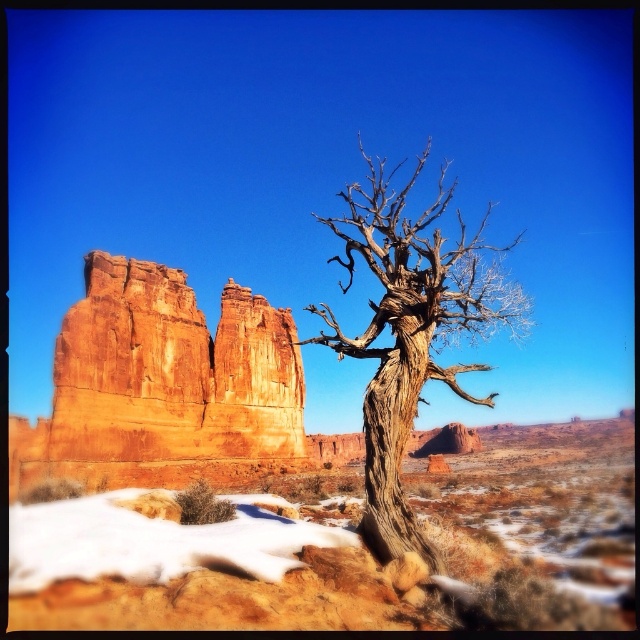
You are standing in the desert scene. There is a point marked at coordinates (348, 547). What object does this point correspond to?

The point at coordinates (348, 547) corresponds to the desert sandstone rock at center.

You are a geologist examining the desert landscape. You need to determine which rock formation is taller between the desert sandstone rock at center and the rustic sandstone rock formation at left. Based on the scene, which one is taller?

The rustic sandstone rock formation at left is taller than the desert sandstone rock at center.

You are a geologist examining the desert landscape. You notice a point marked at coordinates (166, 381). Based on the scene description, what geological feature does this point most likely represent?

The point at (166, 381) most likely represents the rustic sandstone rock formation at left, as the objects description states that this coordinate indicates that specific geological feature.